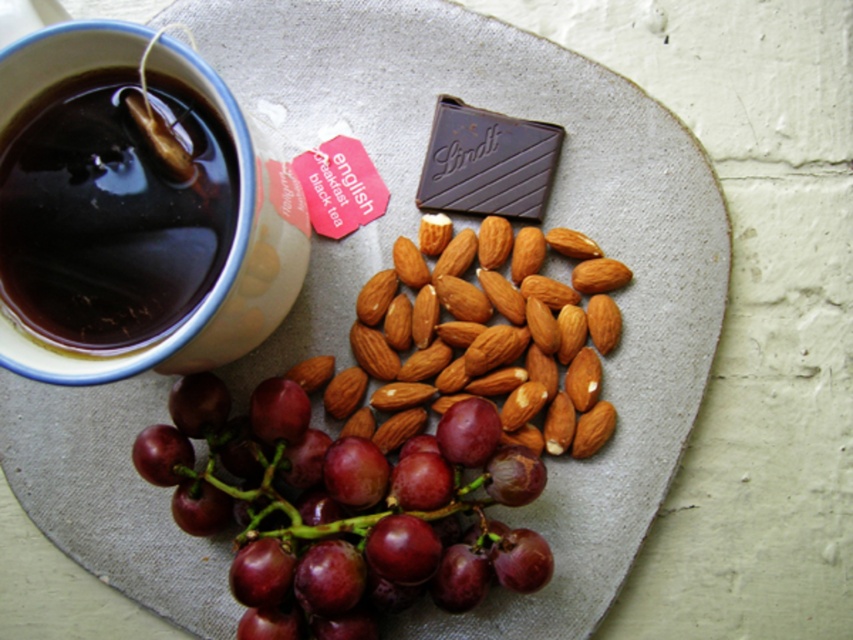
You are arranging snacks on a plate and want to place the dark brown liquid at upper left and the smooth brown almonds at center. Based on the scene, where should you position the almonds relative to the cup?

The dark brown liquid at upper left is above the smooth brown almonds at center, so the almonds should be placed below the cup on the plate.

You have a small container that can only fit items up to 5 centimeters in width. You need to store both the smooth brown almonds at center and the dark chocolate bar at center. Which item will not fit in the container?

The smooth brown almonds at center will not fit in the container because its width is larger than the dark chocolate bar at center, exceeding the 5 centimeter limit.